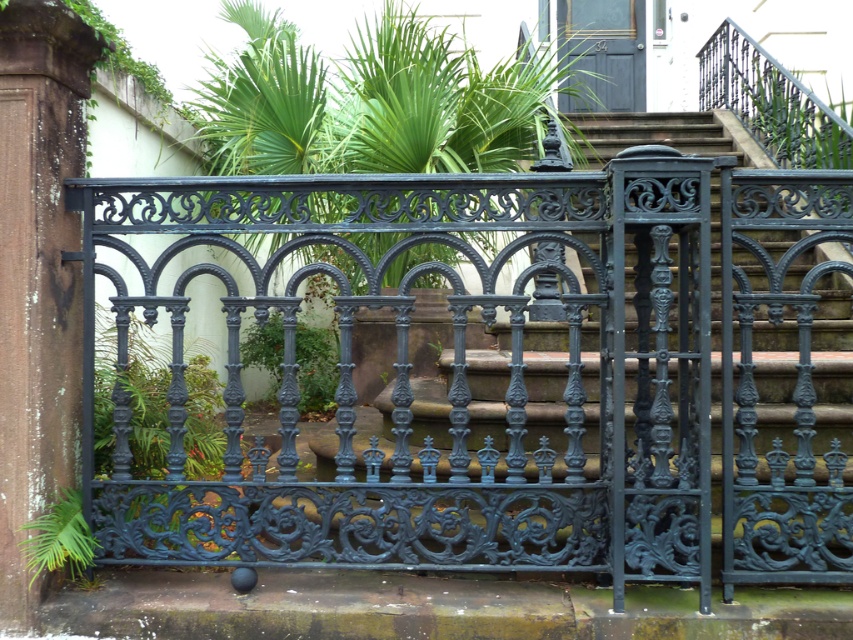
Question: Does glossy wrought iron gate at center have a greater width compared to green leafy plant at center?

Choices:
 (A) no
 (B) yes

Answer: (B)

Question: Is green mossy stone pillar at left positioned before green leafy plant at lower left?

Choices:
 (A) no
 (B) yes

Answer: (B)

Question: Observing the image, what is the correct spatial positioning of green mossy stone pillar at left in reference to green leafy plant at lower left?

Choices:
 (A) left
 (B) right

Answer: (A)

Question: Which object is closer to the camera taking this photo?

Choices:
 (A) green leafy plant at lower left
 (B) matte blue door at upper center

Answer: (A)

Question: Which point is closer to the camera taking this photo?

Choices:
 (A) (331, 401)
 (B) (129, 314)
 (C) (369, 512)
 (D) (36, 397)

Answer: (D)

Question: Which point is closer to the camera?

Choices:
 (A) green mossy stone pillar at left
 (B) matte blue door at upper center

Answer: (A)